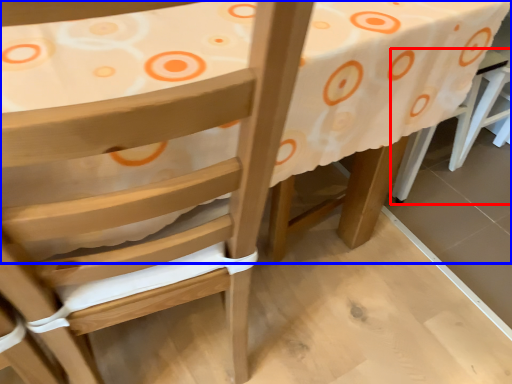
Question: Which object is closer to the camera taking this photo, chair (highlighted by a red box) or table (highlighted by a blue box)?

Choices:
 (A) chair
 (B) table

Answer: (B)